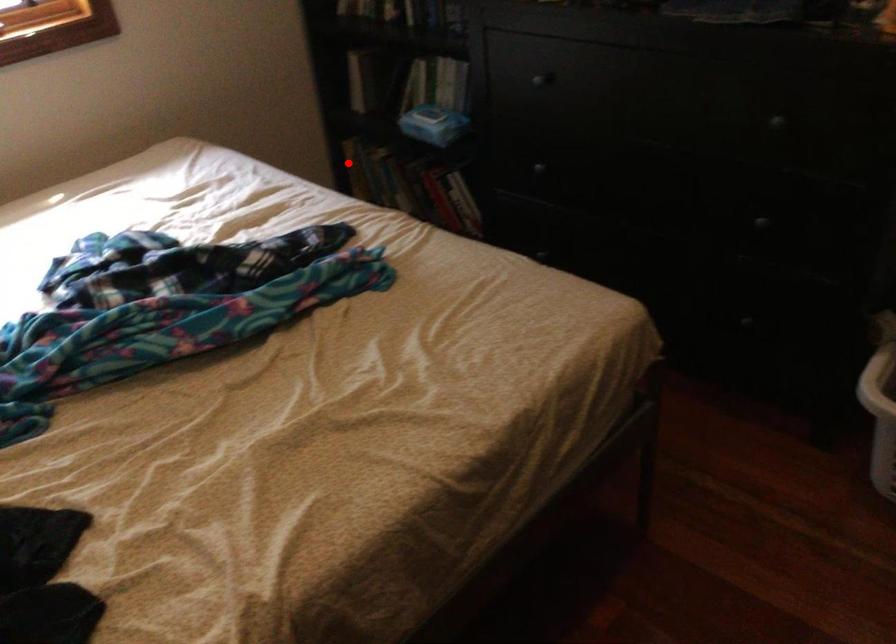
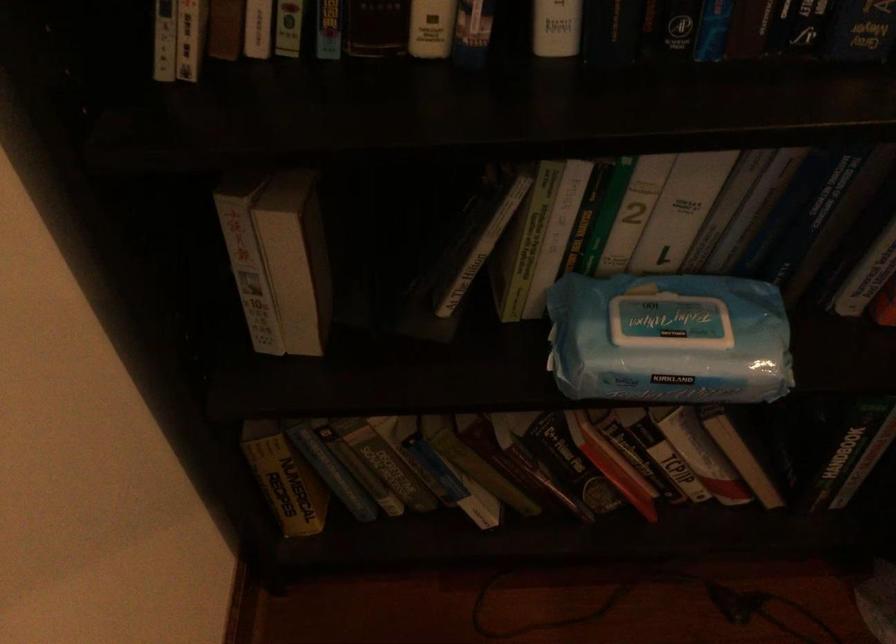
In the second image, find the point that corresponds to the highlighted location in the first image.

(285, 478)